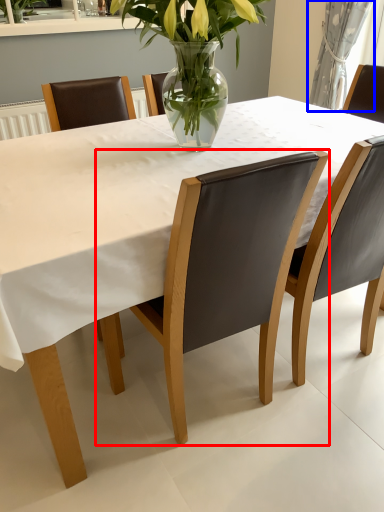
Question: Which point is further to the camera, chair (highlighted by a red box) or curtain (highlighted by a blue box)?

Choices:
 (A) chair
 (B) curtain

Answer: (B)